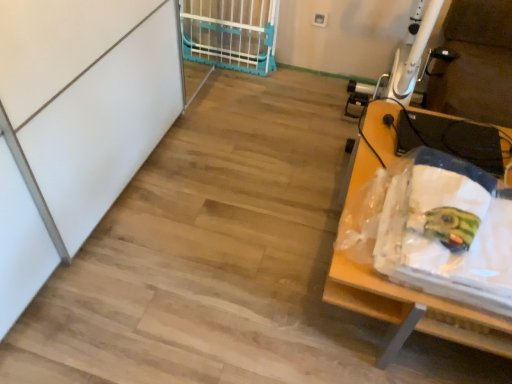
This screenshot has height=384, width=512. In order to click on free location to the left of wooden table at right in this screenshot , I will do `click(236, 244)`.